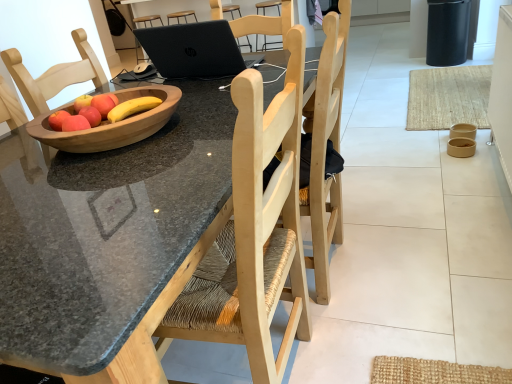
Where is `vacant area in front of matte wood apple at center, which is the 1th apple in bottom-to-top order`? The width and height of the screenshot is (512, 384). vacant area in front of matte wood apple at center, which is the 1th apple in bottom-to-top order is located at coordinates (76, 166).